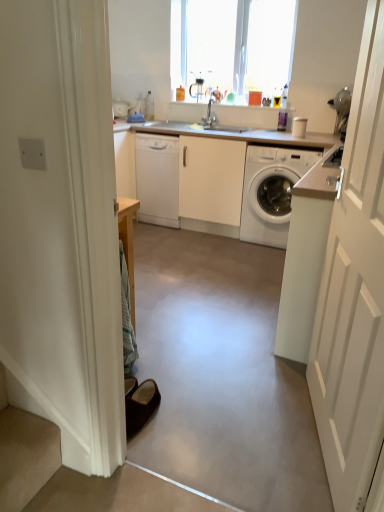
This screenshot has width=384, height=512. Find the location of `free space above smooth concrete floor at center (from a real-world perspective)`. free space above smooth concrete floor at center (from a real-world perspective) is located at coordinates (206, 297).